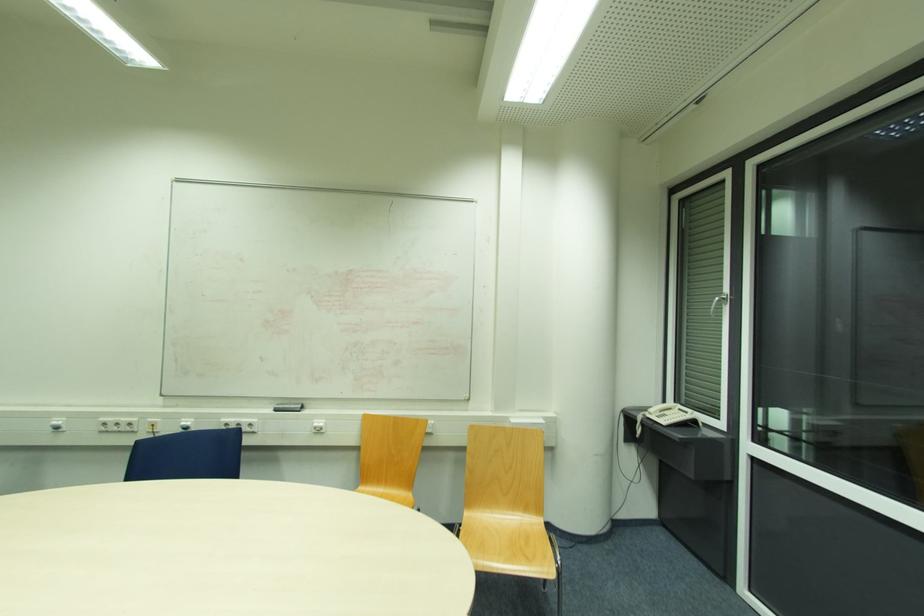
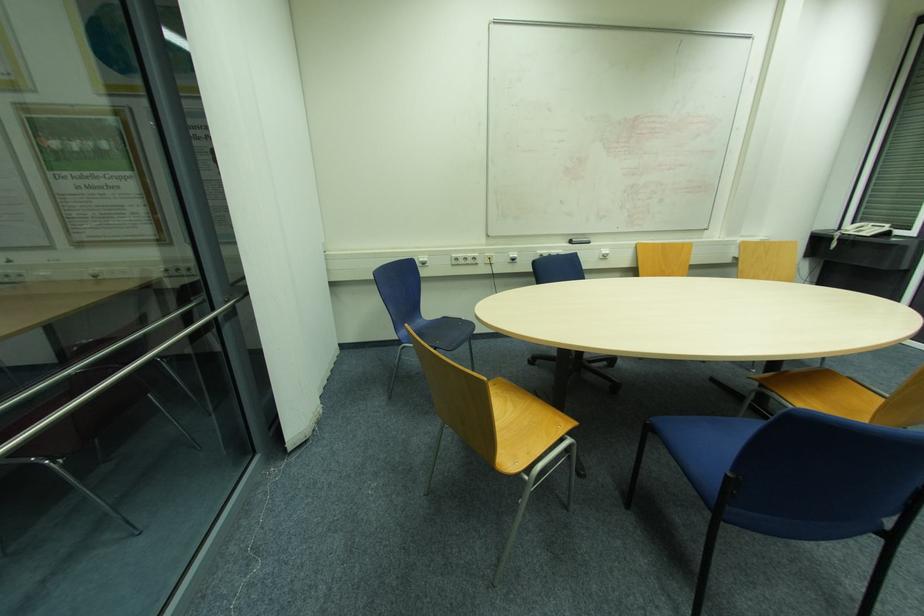
Where in the second image is the point corresponding to the point at 317,424 from the first image?

(604, 253)